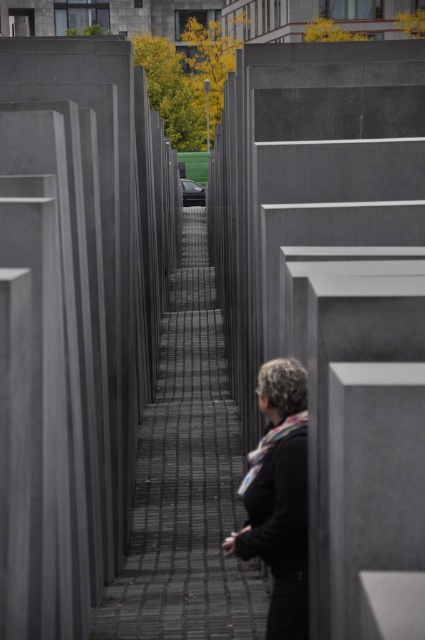
In the scene shown: Does gray concrete at center appear under black matte jacket at center?

Yes, gray concrete at center is below black matte jacket at center.

Which is in front, point (147, 486) or point (283, 449)?

Positioned in front is point (283, 449).

Is point (158, 474) closer to viewer compared to point (263, 403)?

That is False.

The image size is (425, 640). Identify the location of gray concrete at center. (187, 483).